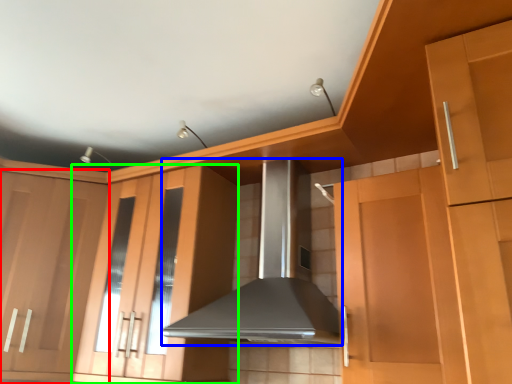
Question: Which is farther away from cabinetry (highlighted by a red box)? home appliance (highlighted by a blue box) or cabinetry (highlighted by a green box)?

Choices:
 (A) home appliance
 (B) cabinetry

Answer: (A)